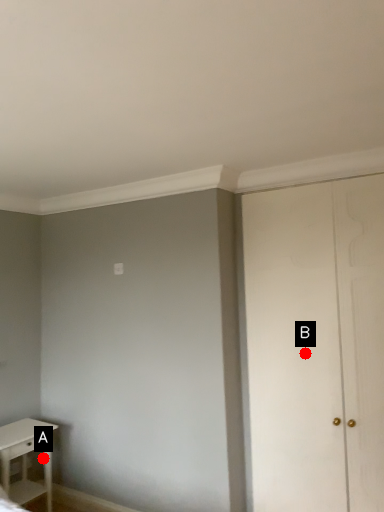
Question: Two points are circled on the image, labeled by A and B beside each circle. Among these points, which one is nearest to the camera?

Choices:
 (A) A is closer
 (B) B is closer

Answer: (B)